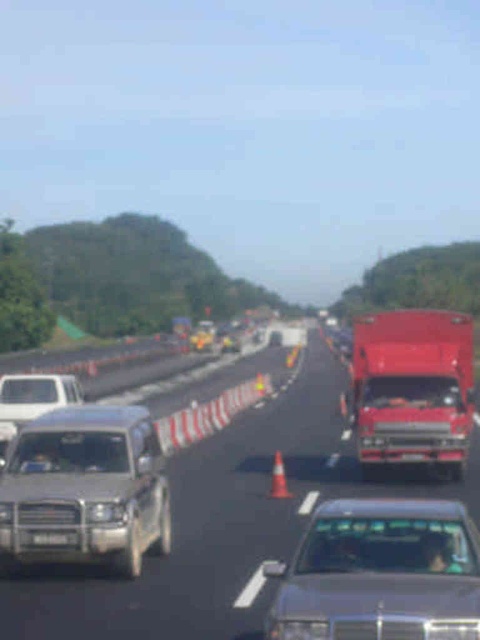
You are a delivery driver who needs to determine which vehicle is lower to the ground between the silver metallic suv at center and the shiny red truck at center. Which one should you choose to pass under a low bridge?

The silver metallic suv at center has a lesser height compared to the shiny red truck at center, so you should choose the silver metallic suv at center to pass under the low bridge.

You are a delivery driver who needs to pass through this highway section. Your truck is 10 meters long. There is a metallic silver truck at center and a black plastic license plate at center in your path. Can your truck fit between them without overlapping?

The metallic silver truck at center is 9.94 meters from the black plastic license plate at center. Since your truck is 10 meters long, it cannot fit between them without overlapping as the distance is slightly shorter than the truck length.

You are driving a car and see the silver metallic suv at center and the shiny red truck at center on the highway. Which vehicle is positioned to the left side from your perspective?

The silver metallic suv at center is to the left of the shiny red truck at center, so the silver metallic suv at center is positioned to the left side from your perspective.